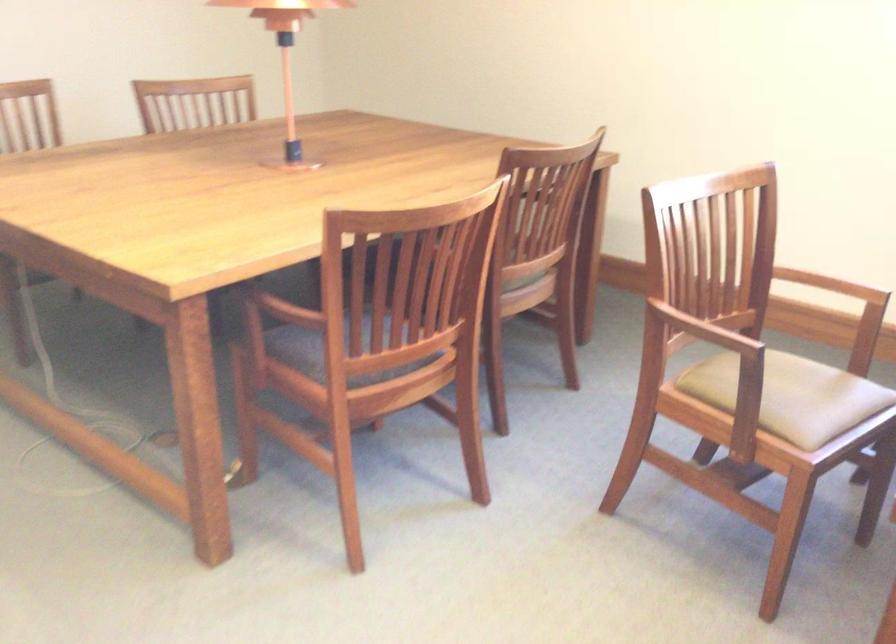
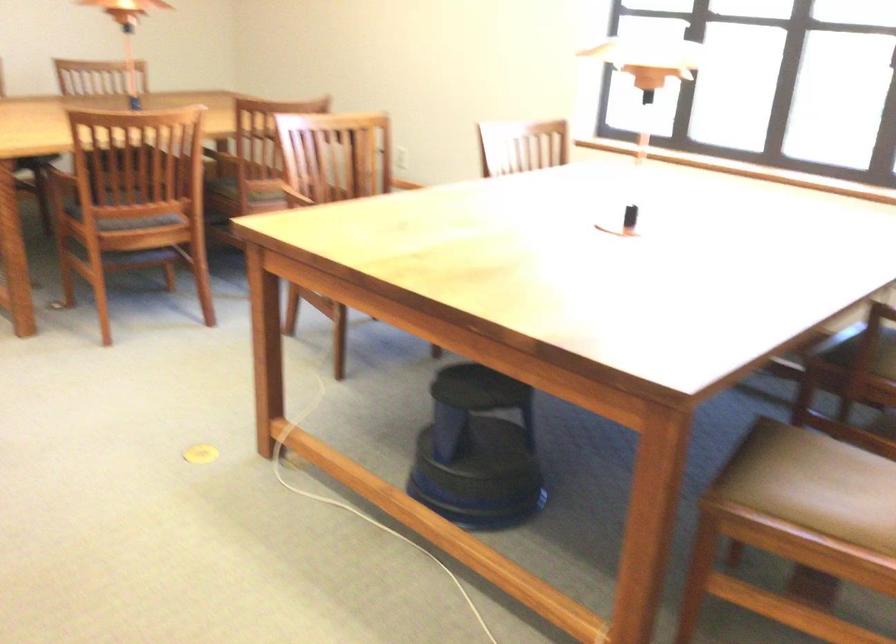
Question: I am providing you with two images of the same scene from different viewpoints. After the viewpoint changes to image2, which objects are now occluded?

Choices:
 (A) black step stool
 (B) beige chair sitting surface
 (C) black binoculars
 (D) lamp pull switch

Answer: (B)